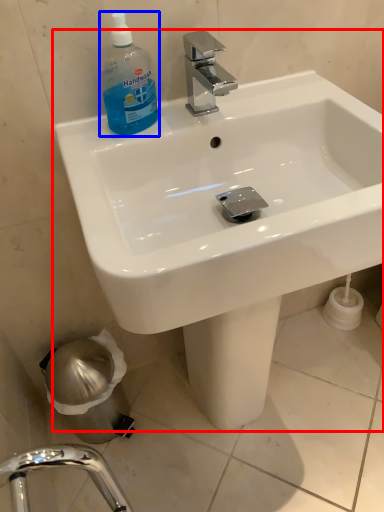
Question: Which point is closer to the camera, sink (highlighted by a red box) or cleaning product (highlighted by a blue box)?

Choices:
 (A) sink
 (B) cleaning product

Answer: (A)